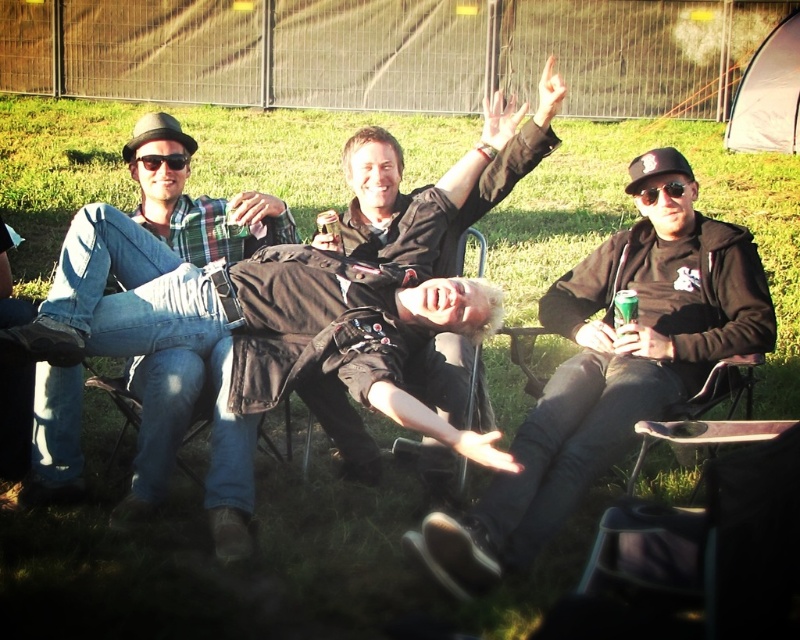
Question: Which point is farther from the camera taking this photo?

Choices:
 (A) (421, 401)
 (B) (430, 420)
 (C) (566, 305)
 (D) (630, 314)

Answer: (C)

Question: Which point appears farthest from the camera in this image?

Choices:
 (A) (417, 468)
 (B) (226, 538)
 (C) (142, 164)
 (D) (684, 188)

Answer: (C)

Question: Can you confirm if black matte jacket at center is positioned to the left of black plastic sunglasses at upper left?

Choices:
 (A) yes
 (B) no

Answer: (B)

Question: Does black fabric chair at center appear on the left side of metallic silver can at center?

Choices:
 (A) no
 (B) yes

Answer: (A)

Question: Does black fabric chair at center have a larger size compared to green plastic cup at center?

Choices:
 (A) yes
 (B) no

Answer: (A)

Question: Among these objects, which one is nearest to the camera?

Choices:
 (A) metallic silver can at center
 (B) black plastic sunglasses at upper center
 (C) black matte jacket at center

Answer: (C)